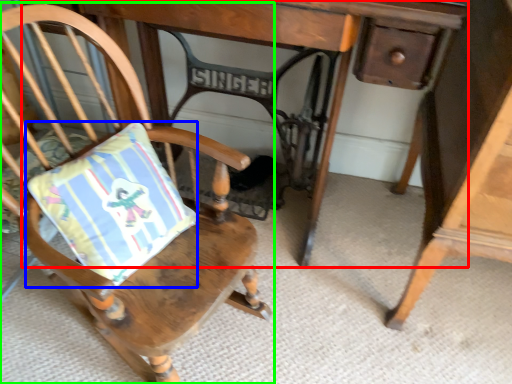
Question: Considering the real-world distances, which object is closest to table (highlighted by a red box)? pillow (highlighted by a blue box) or chair (highlighted by a green box).

Choices:
 (A) pillow
 (B) chair

Answer: (B)